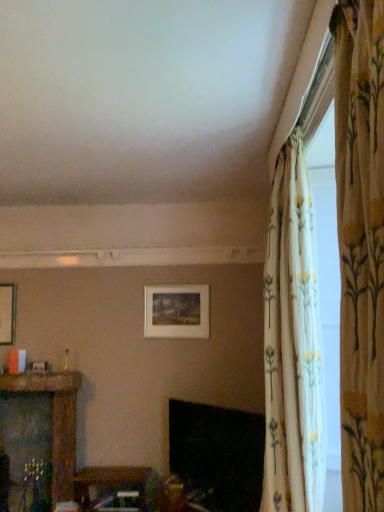
In order to face wooden table at lower center, positioned as the first furniture in right-to-left order, should I rotate leftwards or rightwards?

Rotate left and turn 9.999 degrees.

What is the approximate height of floral fabric curtain at right, acting as the 2th curtain starting from the back?

1.39 meters.

The width and height of the screenshot is (384, 512). What do you see at coordinates (55, 420) in the screenshot?
I see `wooden carved shelf at left, arranged as the 2th furniture when viewed from the right` at bounding box center [55, 420].

The height and width of the screenshot is (512, 384). Describe the element at coordinates (218, 454) in the screenshot. I see `black glossy fireplace at lower center` at that location.

From the picture: What is the approximate height of black glossy fireplace at lower center?

black glossy fireplace at lower center is 58.34 centimeters tall.

Describe the element at coordinates (292, 345) in the screenshot. I see `floral fabric curtain at upper right, the 1th curtain positioned from the back` at that location.

This screenshot has width=384, height=512. What are the coordinates of `wooden table at lower center, positioned as the first furniture in right-to-left order` in the screenshot? It's located at (117, 488).

Choose the correct answer: Is wooden table at lower center, positioned as the first furniture in right-to-left order, inside black glossy fireplace at lower center or outside it?

wooden table at lower center, positioned as the first furniture in right-to-left order, is outside black glossy fireplace at lower center.

Does wooden table at lower center, positioned as the first furniture in right-to-left order, have a greater height compared to black glossy fireplace at lower center?

In fact, wooden table at lower center, positioned as the first furniture in right-to-left order, may be shorter than black glossy fireplace at lower center.

From the picture: What's the angular difference between floral fabric curtain at upper right, the 2th curtain viewed from the front, and wooden table at lower center, the 2th furniture positioned from the left,'s facing directions?

91.2 degrees separate the facing orientations of floral fabric curtain at upper right, the 2th curtain viewed from the front, and wooden table at lower center, the 2th furniture positioned from the left.

Between floral fabric curtain at upper right, the 2th curtain viewed from the front, and wooden table at lower center, the 2th furniture positioned from the left, which one has smaller size?

wooden table at lower center, the 2th furniture positioned from the left, is smaller.

From the image's perspective, which is above, floral fabric curtain at upper right, the 1th curtain positioned from the back, or wooden table at lower center, the 2th furniture positioned from the left?

floral fabric curtain at upper right, the 1th curtain positioned from the back, from the image's perspective.

Does point (281, 296) appear closer or farther from the camera than point (97, 496)?

Point (281, 296).

From a real-world perspective, who is located lower, wooden table at lower center, positioned as the first furniture in right-to-left order, or wooden carved shelf at left, the 1th furniture from the left?

In real-world perspective, wooden table at lower center, positioned as the first furniture in right-to-left order, is lower.

From the image's perspective, is wooden table at lower center, positioned as the first furniture in right-to-left order, below wooden carved shelf at left, the 1th furniture from the left?

Yes.

This screenshot has width=384, height=512. I want to click on furniture located above the wooden table at lower center, positioned as the first furniture in right-to-left order (from a real-world perspective), so click(x=55, y=420).

Considering the relative sizes of wooden table at lower center, positioned as the first furniture in right-to-left order, and wooden carved shelf at left, arranged as the 2th furniture when viewed from the right, in the image provided, is wooden table at lower center, positioned as the first furniture in right-to-left order, smaller than wooden carved shelf at left, arranged as the 2th furniture when viewed from the right,?

Indeed, wooden table at lower center, positioned as the first furniture in right-to-left order, has a smaller size compared to wooden carved shelf at left, arranged as the 2th furniture when viewed from the right.

Is the depth of wooden carved shelf at left, arranged as the 2th furniture when viewed from the right, greater than that of floral fabric curtain at upper right, the 1th curtain positioned from the back?

Yes, it is behind floral fabric curtain at upper right, the 1th curtain positioned from the back.

From the image's perspective, which is below, wooden carved shelf at left, the 1th furniture from the left, or floral fabric curtain at upper right, the 1th curtain positioned from the back?

From the image's view, wooden carved shelf at left, the 1th furniture from the left, is below.

From a real-world perspective, is wooden carved shelf at left, arranged as the 2th furniture when viewed from the right, positioned under floral fabric curtain at upper right, the 1th curtain positioned from the back, based on gravity?

Correct, in the physical world, wooden carved shelf at left, arranged as the 2th furniture when viewed from the right, is lower than floral fabric curtain at upper right, the 1th curtain positioned from the back.

Does wooden carved shelf at left, the 1th furniture from the left, appear on the left side of floral fabric curtain at upper right, the 2th curtain viewed from the front?

Yes.

From the image's perspective, is floral fabric curtain at right, acting as the 2th curtain starting from the back, located beneath wooden table at lower center, positioned as the first furniture in right-to-left order?

Actually, floral fabric curtain at right, acting as the 2th curtain starting from the back, appears above wooden table at lower center, positioned as the first furniture in right-to-left order, in the image.

Identify the location of the 2nd curtain in front of the wooden table at lower center, positioned as the first furniture in right-to-left order, starting your count from the anchor. (360, 246).

Considering the positions of objects floral fabric curtain at right, acting as the 2th curtain starting from the back, and wooden table at lower center, the 2th furniture positioned from the left, in the image provided, who is in front, floral fabric curtain at right, acting as the 2th curtain starting from the back, or wooden table at lower center, the 2th furniture positioned from the left,?

floral fabric curtain at right, acting as the 2th curtain starting from the back, is more forward.

From a real-world perspective, is floral fabric curtain at right, marked as the first curtain in a front-to-back arrangement, located higher than wooden table at lower center, positioned as the first furniture in right-to-left order?

Yes, from a real-world perspective, floral fabric curtain at right, marked as the first curtain in a front-to-back arrangement, is on top of wooden table at lower center, positioned as the first furniture in right-to-left order.

Considering the relative positions of wooden carved shelf at left, arranged as the 2th furniture when viewed from the right, and matte white picture frame at center in the image provided, is wooden carved shelf at left, arranged as the 2th furniture when viewed from the right, to the right of matte white picture frame at center from the viewer's perspective?

In fact, wooden carved shelf at left, arranged as the 2th furniture when viewed from the right, is to the left of matte white picture frame at center.

Does wooden carved shelf at left, the 1th furniture from the left, have a smaller size compared to matte white picture frame at center?

No, wooden carved shelf at left, the 1th furniture from the left, is not smaller than matte white picture frame at center.

Which of these two, wooden carved shelf at left, arranged as the 2th furniture when viewed from the right, or matte white picture frame at center, is thinner?

Thinner between the two is matte white picture frame at center.

Which is in front, wooden carved shelf at left, the 1th furniture from the left, or matte white picture frame at center?

wooden carved shelf at left, the 1th furniture from the left, is more forward.

Considering the sizes of objects floral fabric curtain at right, marked as the first curtain in a front-to-back arrangement, and floral fabric curtain at upper right, the 2th curtain viewed from the front, in the image provided, who is smaller, floral fabric curtain at right, marked as the first curtain in a front-to-back arrangement, or floral fabric curtain at upper right, the 2th curtain viewed from the front,?

floral fabric curtain at right, marked as the first curtain in a front-to-back arrangement.

Identify the location of curtain above the floral fabric curtain at upper right, the 2th curtain viewed from the front (from a real-world perspective). This screenshot has width=384, height=512. (360, 246).

Considering the relative sizes of floral fabric curtain at right, marked as the first curtain in a front-to-back arrangement, and floral fabric curtain at upper right, the 2th curtain viewed from the front, in the image provided, is floral fabric curtain at right, marked as the first curtain in a front-to-back arrangement, shorter than floral fabric curtain at upper right, the 2th curtain viewed from the front,?

Correct, floral fabric curtain at right, marked as the first curtain in a front-to-back arrangement, is not as tall as floral fabric curtain at upper right, the 2th curtain viewed from the front.

Is floral fabric curtain at right, marked as the first curtain in a front-to-back arrangement, far away from floral fabric curtain at upper right, the 1th curtain positioned from the back?

Absolutely, floral fabric curtain at right, marked as the first curtain in a front-to-back arrangement, is distant from floral fabric curtain at upper right, the 1th curtain positioned from the back.

You are a GUI agent. You are given a task and a screenshot of the screen. Output one action in this format:
    pyautogui.click(x=<x>, y=<y>)
    Task: Click on the fireplace above the wooden table at lower center, the 2th furniture positioned from the left (from a real-world perspective)
    The height and width of the screenshot is (512, 384).
    Given the screenshot: What is the action you would take?
    pyautogui.click(x=218, y=454)

I want to click on the 1st furniture behind the floral fabric curtain at upper right, the 2th curtain viewed from the front, starting your count from the anchor, so click(x=117, y=488).

Estimate the real-world distances between objects in this image. Which object is further from black glossy fireplace at lower center, wooden table at lower center, the 2th furniture positioned from the left, or floral fabric curtain at right, acting as the 2th curtain starting from the back?

Based on the image, floral fabric curtain at right, acting as the 2th curtain starting from the back, appears to be further to black glossy fireplace at lower center.

Considering their positions, is wooden table at lower center, positioned as the first furniture in right-to-left order, positioned closer to floral fabric curtain at upper right, the 1th curtain positioned from the back, than matte white picture frame at center?

Among the two, matte white picture frame at center is located nearer to floral fabric curtain at upper right, the 1th curtain positioned from the back.

Based on their spatial positions, is wooden table at lower center, positioned as the first furniture in right-to-left order, or wooden carved shelf at left, arranged as the 2th furniture when viewed from the right, further from matte white picture frame at center?

Among the two, wooden table at lower center, positioned as the first furniture in right-to-left order, is located further to matte white picture frame at center.

Which object lies nearer to the anchor point wooden carved shelf at left, arranged as the 2th furniture when viewed from the right, floral fabric curtain at upper right, the 1th curtain positioned from the back, or floral fabric curtain at right, marked as the first curtain in a front-to-back arrangement?

Among the two, floral fabric curtain at upper right, the 1th curtain positioned from the back, is located nearer to wooden carved shelf at left, arranged as the 2th furniture when viewed from the right.

Based on the photo, which object lies further to the anchor point matte white picture frame at center, black glossy fireplace at lower center or wooden table at lower center, the 2th furniture positioned from the left?

wooden table at lower center, the 2th furniture positioned from the left, lies further to matte white picture frame at center than the other object.

Considering their positions, is wooden carved shelf at left, arranged as the 2th furniture when viewed from the right, positioned closer to floral fabric curtain at right, acting as the 2th curtain starting from the back, than matte white picture frame at center?

Among the two, matte white picture frame at center is located nearer to floral fabric curtain at right, acting as the 2th curtain starting from the back.

From the image, which object appears to be farther from wooden table at lower center, positioned as the first furniture in right-to-left order, black glossy fireplace at lower center or matte white picture frame at center?

The object further to wooden table at lower center, positioned as the first furniture in right-to-left order, is matte white picture frame at center.

From the picture: Which object lies nearer to the anchor point wooden table at lower center, the 2th furniture positioned from the left, floral fabric curtain at right, acting as the 2th curtain starting from the back, or floral fabric curtain at upper right, the 1th curtain positioned from the back?

floral fabric curtain at upper right, the 1th curtain positioned from the back, lies closer to wooden table at lower center, the 2th furniture positioned from the left, than the other object.

Identify the location of picture frame located between wooden carved shelf at left, arranged as the 2th furniture when viewed from the right, and black glossy fireplace at lower center in the left-right direction. (176, 311).

Image resolution: width=384 pixels, height=512 pixels. Identify the location of fireplace between matte white picture frame at center and wooden table at lower center, the 2th furniture positioned from the left, in the vertical direction. (218, 454).

Where is `fireplace between floral fabric curtain at right, acting as the 2th curtain starting from the back, and wooden carved shelf at left, arranged as the 2th furniture when viewed from the right, in the front-back direction`? fireplace between floral fabric curtain at right, acting as the 2th curtain starting from the back, and wooden carved shelf at left, arranged as the 2th furniture when viewed from the right, in the front-back direction is located at coordinates (218, 454).

At what (x,y) coordinates should I click in order to perform the action: click on furniture between matte white picture frame at center and wooden table at lower center, the 2th furniture positioned from the left, from top to bottom. Please return your answer as a coordinate pair (x, y). Looking at the image, I should click on (55, 420).